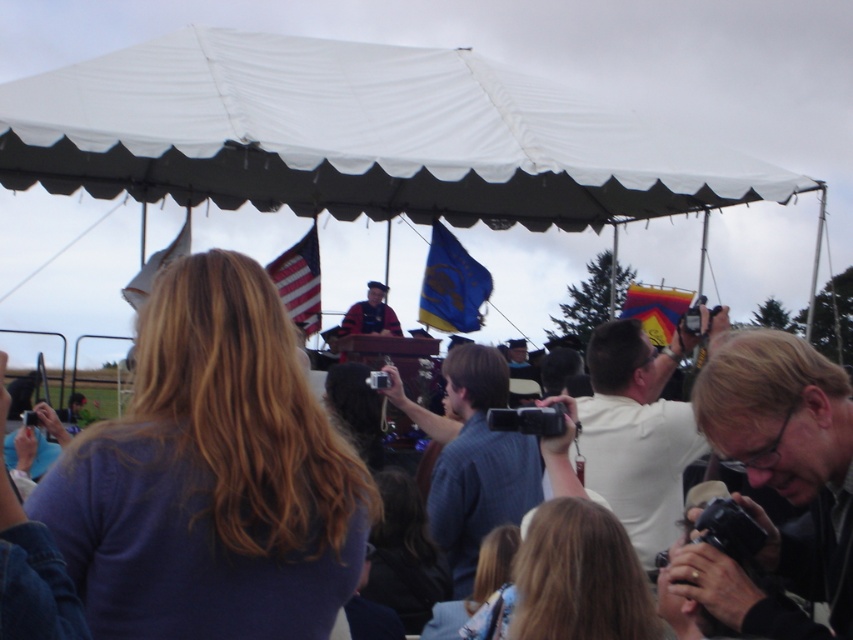
Describe the element at coordinates (656, 308) in the screenshot. This screenshot has width=853, height=640. I see `rainbow fabric kite at upper right` at that location.

Is rainbow fabric kite at upper right smaller than matte black uniform at center?

No.

Which is in front, point (627, 296) or point (384, 316)?

Point (384, 316)

Identify the location of rainbow fabric kite at upper right. Image resolution: width=853 pixels, height=640 pixels. (656, 308).

Which is below, white shirt at center or matte black uniform at center?

Positioned lower is white shirt at center.

Between white shirt at center and matte black uniform at center, which one appears on the left side from the viewer's perspective?

From the viewer's perspective, matte black uniform at center appears more on the left side.

Between point (664, 449) and point (350, 320), which one is positioned behind?

The point (350, 320) is behind.

Image resolution: width=853 pixels, height=640 pixels. Find the location of `white shirt at center`. white shirt at center is located at coordinates (637, 433).

Does blue plaid shirt at center lie behind white fabric flag at upper left?

That is False.

Can you confirm if blue plaid shirt at center is positioned to the left of white fabric flag at upper left?

Incorrect, blue plaid shirt at center is not on the left side of white fabric flag at upper left.

Measure the distance between blue plaid shirt at center and camera.

The distance of blue plaid shirt at center from camera is 12.68 meters.

At what (x,y) coordinates should I click in order to perform the action: click on blue plaid shirt at center. Please return your answer as a coordinate pair (x, y). Looking at the image, I should click on tap(473, 460).